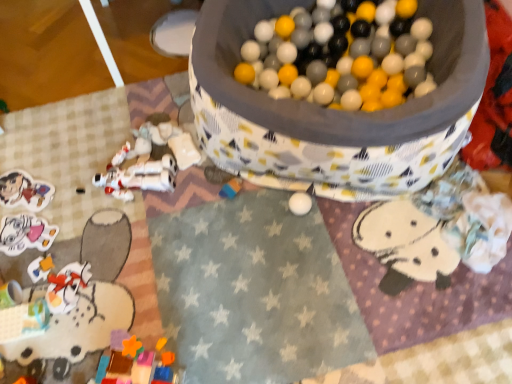
Where is `vacant space in between matte cardboard sticker at lower left, which is the sixth toy from right to left, and white plastic astronaut at lower left, placed as the 3th toy when sorted from right to left`? The width and height of the screenshot is (512, 384). vacant space in between matte cardboard sticker at lower left, which is the sixth toy from right to left, and white plastic astronaut at lower left, placed as the 3th toy when sorted from right to left is located at coordinates (72, 187).